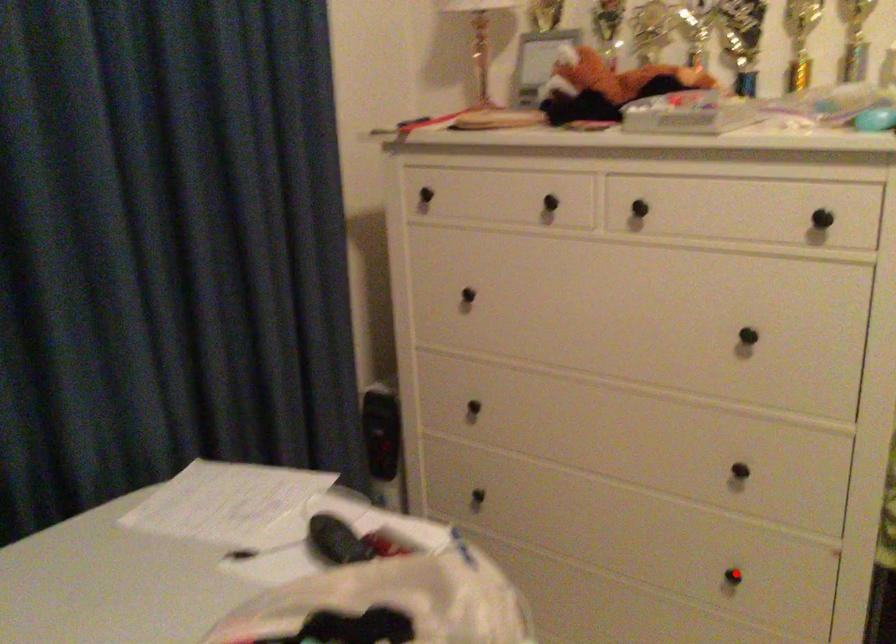
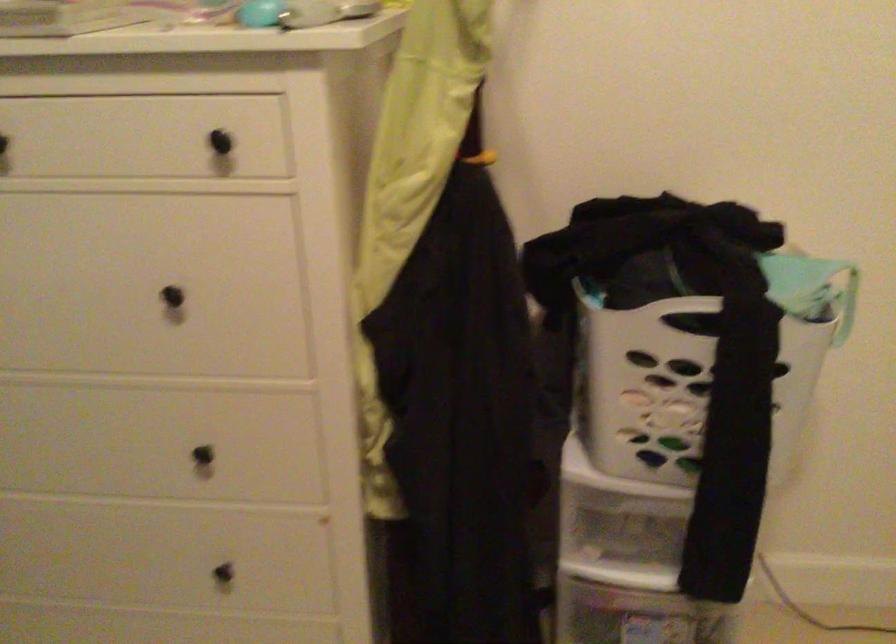
Question: A red point is marked in image1. In image2, is the corresponding 3D point closer to the camera or farther? Reply with the corresponding letter.

Choices:
 (A) The corresponding 3D point is closer.
 (B) The corresponding 3D point is farther.

Answer: (A)